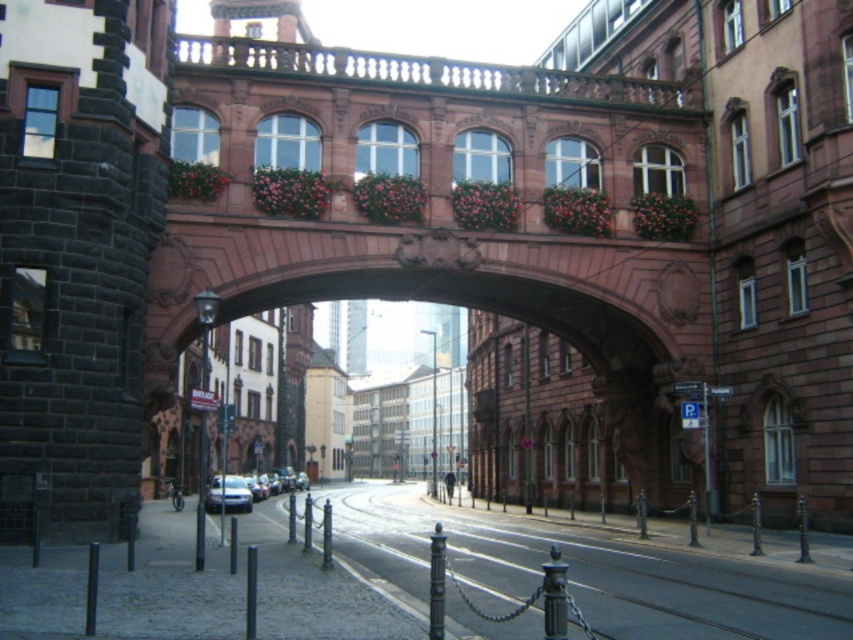
Question: Which point is farther to the camera?

Choices:
 (A) (635, 588)
 (B) (210, 492)

Answer: (B)

Question: Is metallic gray train track at lower center to the right of silver metallic car at lower left from the viewer's perspective?

Choices:
 (A) yes
 (B) no

Answer: (A)

Question: Does metallic gray train track at lower center have a lesser width compared to silver metallic car at lower left?

Choices:
 (A) no
 (B) yes

Answer: (A)

Question: Which point is closer to the camera taking this photo?

Choices:
 (A) (728, 595)
 (B) (241, 483)

Answer: (A)

Question: Does metallic gray train track at lower center appear on the right side of silver metallic car at lower left?

Choices:
 (A) yes
 (B) no

Answer: (A)